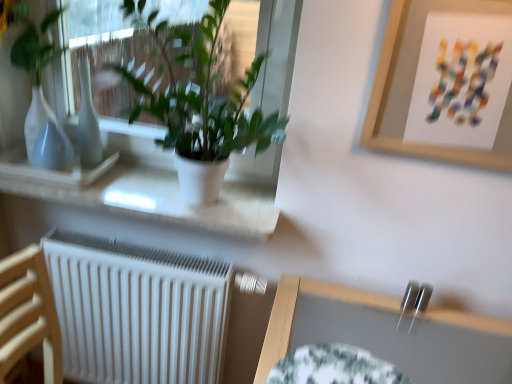
Question: Is matte white vase at left, the 1th vase in the left-to-right sequence, outside of wooden picture frame at upper right?

Choices:
 (A) no
 (B) yes

Answer: (B)

Question: Does matte white vase at left, the 1th vase in the left-to-right sequence, appear on the right side of wooden picture frame at upper right?

Choices:
 (A) no
 (B) yes

Answer: (A)

Question: Does matte white vase at left, the 1th vase in the left-to-right sequence, have a greater width compared to wooden picture frame at upper right?

Choices:
 (A) yes
 (B) no

Answer: (A)

Question: From a real-world perspective, is matte white vase at left, the 1th vase in the left-to-right sequence, over wooden picture frame at upper right?

Choices:
 (A) no
 (B) yes

Answer: (A)

Question: Can you confirm if matte white vase at left, acting as the second vase starting from the right, is positioned to the left of wooden picture frame at upper right?

Choices:
 (A) yes
 (B) no

Answer: (A)

Question: Is wooden picture frame at upper right a part of matte white vase at left, acting as the second vase starting from the right?

Choices:
 (A) yes
 (B) no

Answer: (B)

Question: From a real-world perspective, is white matte window sill at upper left below white matte radiator at lower left?

Choices:
 (A) yes
 (B) no

Answer: (B)

Question: Is white matte window sill at upper left far from white matte radiator at lower left?

Choices:
 (A) no
 (B) yes

Answer: (A)

Question: Does white matte window sill at upper left come behind white matte radiator at lower left?

Choices:
 (A) yes
 (B) no

Answer: (B)

Question: From the image's perspective, would you say white matte window sill at upper left is positioned over white matte radiator at lower left?

Choices:
 (A) yes
 (B) no

Answer: (A)

Question: Is white matte window sill at upper left outside white matte radiator at lower left?

Choices:
 (A) no
 (B) yes

Answer: (B)

Question: Is white matte window sill at upper left next to white matte radiator at lower left and touching it?

Choices:
 (A) no
 (B) yes

Answer: (A)

Question: Is white matte radiator at lower left located outside matte white vase at left, the 1th vase in the left-to-right sequence?

Choices:
 (A) no
 (B) yes

Answer: (B)